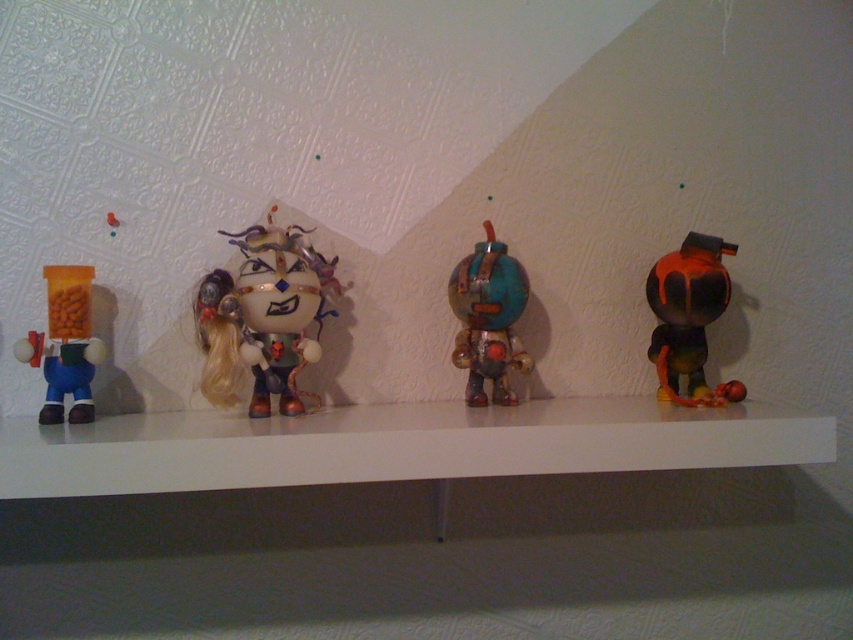
You are a delivery person who needs to place a new 10 inch long package between the matte white figurine at center and the rusty metallic robot at center on the shelf. Is there enough space between them to fit the package?

The distance between the matte white figurine at center and the rusty metallic robot at center is 8.46 inches. Since the package is 10 inches long, it won not fit between them as the space is smaller than the package.

You are a photographer holding a camera and want to take a photo of the rusty metallic robot at center. The camera requires a minimum distance of 40 inches to focus properly. Can you take a clear photo from your current position?

The rusty metallic robot at center and camera are 38.26 inches apart. Since the minimum focus distance is 40 inches, you need to move back to ensure proper focus.

You are arranging two items on a shelf. You have a white glossy mantle at center and a rusty metallic robot at center. According to the scene description, where should you place the white glossy mantle relative to the rusty metallic robot?

The white glossy mantle at center should be placed to the left of the rusty metallic robot at center as per the scene description.